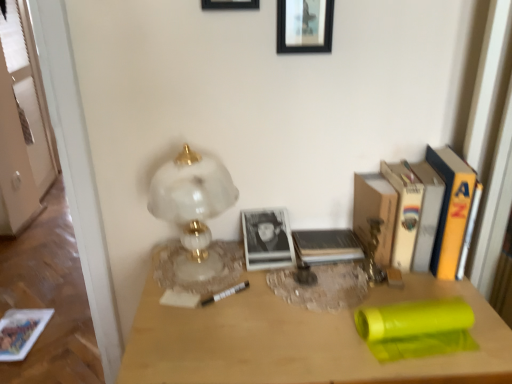
Question: Is matte wood desk at center touching hardcover book at center, positioned as the first paperback book in left-to-right order?

Choices:
 (A) yes
 (B) no

Answer: (B)

Question: Is matte wood desk at center taller than hardcover book at center, positioned as the first paperback book in left-to-right order?

Choices:
 (A) yes
 (B) no

Answer: (A)

Question: From a real-world perspective, does matte wood desk at center sit lower than hardcover book at center, positioned as the first paperback book in left-to-right order?

Choices:
 (A) no
 (B) yes

Answer: (B)

Question: Considering the relative sizes of matte wood desk at center and hardcover book at center, positioned as the first paperback book in left-to-right order, in the image provided, is matte wood desk at center thinner than hardcover book at center, positioned as the first paperback book in left-to-right order,?

Choices:
 (A) yes
 (B) no

Answer: (B)

Question: From a real-world perspective, does matte wood desk at center stand above hardcover book at center, which is the 5th paperback book in right-to-left order?

Choices:
 (A) yes
 (B) no

Answer: (B)

Question: Is matte wood desk at center closer to the viewer compared to hardcover book at center, positioned as the first paperback book in left-to-right order?

Choices:
 (A) yes
 (B) no

Answer: (A)

Question: Is black matte picture frame at upper center, which is the 2th picture frame in left-to-right order, closer to camera compared to white marble lamp at left?

Choices:
 (A) no
 (B) yes

Answer: (A)

Question: Can you confirm if black matte picture frame at upper center, which ranks as the 1th picture frame in right-to-left order, is positioned to the left of white marble lamp at left?

Choices:
 (A) no
 (B) yes

Answer: (A)

Question: Is black matte picture frame at upper center, which is the 2th picture frame in left-to-right order, not inside white marble lamp at left?

Choices:
 (A) no
 (B) yes

Answer: (B)

Question: From the image's perspective, is black matte picture frame at upper center, which is the 2th picture frame in left-to-right order, below white marble lamp at left?

Choices:
 (A) yes
 (B) no

Answer: (B)

Question: Does black matte picture frame at upper center, which ranks as the 1th picture frame in right-to-left order, appear on the right side of white marble lamp at left?

Choices:
 (A) no
 (B) yes

Answer: (B)

Question: Is white marble lamp at left inside black matte picture frame at upper center, which is the 2th picture frame in left-to-right order?

Choices:
 (A) yes
 (B) no

Answer: (B)

Question: Considering the relative sizes of black matte picture frame at upper center, placed as the second picture frame when sorted from right to left, and white paper at right, which appears as the 2th paperback book when viewed from the right, in the image provided, is black matte picture frame at upper center, placed as the second picture frame when sorted from right to left, smaller than white paper at right, which appears as the 2th paperback book when viewed from the right,?

Choices:
 (A) yes
 (B) no

Answer: (A)